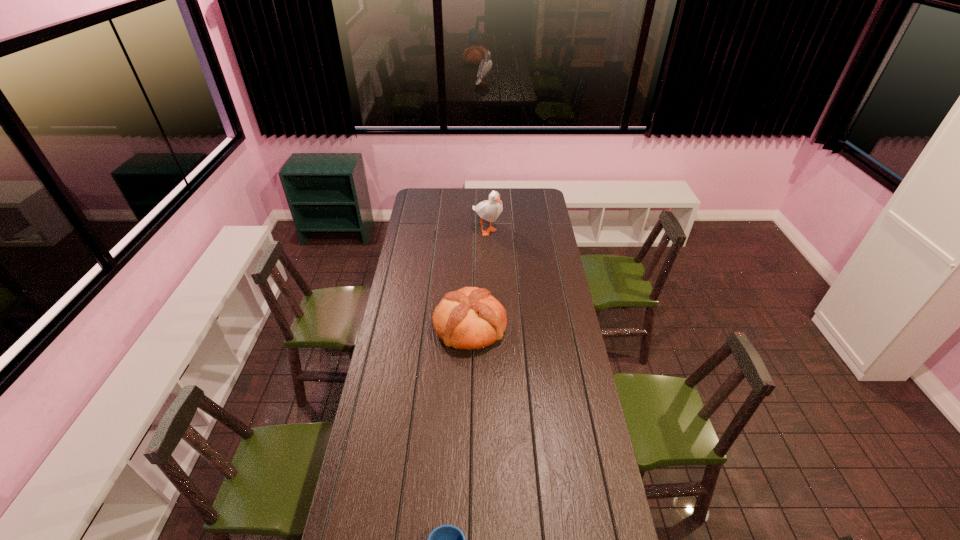
At what (x,y) coordinates should I click in order to perform the action: click on the tallest object. Please return your answer as a coordinate pair (x, y). Looking at the image, I should click on (489, 210).

Image resolution: width=960 pixels, height=540 pixels. I want to click on gull, so click(489, 210).

This screenshot has height=540, width=960. What are the coordinates of `bread` in the screenshot? It's located at (470, 318).

Locate an element on the screen. This screenshot has height=540, width=960. vacant region located at the beak of the farthest object is located at coordinates (488, 255).

The height and width of the screenshot is (540, 960). I want to click on blank space located on the back of the bread, so click(x=471, y=253).

Where is `vacant space at the far edge of the desktop`? The width and height of the screenshot is (960, 540). vacant space at the far edge of the desktop is located at coordinates (468, 193).

Find the location of a particular element. The image size is (960, 540). vacant space at the left edge is located at coordinates (396, 309).

This screenshot has height=540, width=960. Identify the location of vacant area at the right edge. (570, 463).

Identify the location of vacant area at the far left corner of the desktop. (424, 192).

At what (x,y) coordinates should I click in order to perform the action: click on free space at the far right corner. Please return your answer as a coordinate pair (x, y). Image resolution: width=960 pixels, height=540 pixels. Looking at the image, I should click on (540, 204).